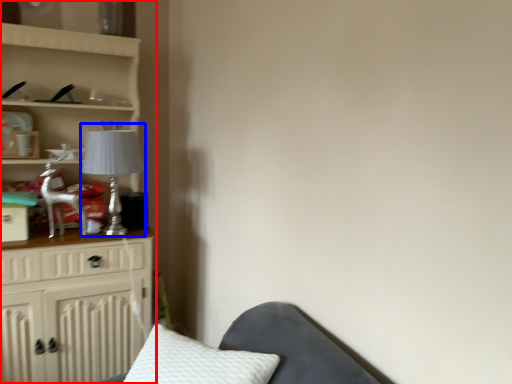
Question: Which of the following is the closest to the observer, furniture (highlighted by a red box) or table lamp (highlighted by a blue box)?

Choices:
 (A) furniture
 (B) table lamp

Answer: (A)